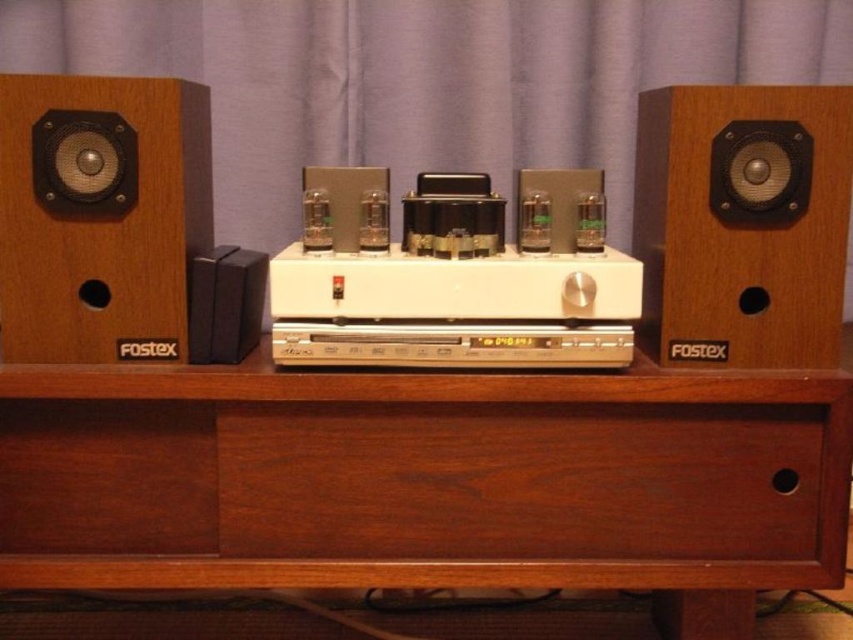
Does purple fabric curtain at upper center appear on the left side of wooden speaker at left?

In fact, purple fabric curtain at upper center is to the right of wooden speaker at left.

Does purple fabric curtain at upper center appear on the right side of wooden speaker at left?

Correct, you'll find purple fabric curtain at upper center to the right of wooden speaker at left.

Who is more forward, (747, 81) or (51, 264)?

Point (51, 264)

What are the coordinates of `purple fabric curtain at upper center` in the screenshot? It's located at (424, 81).

Does brown wood table at center have a larger size compared to black matte speaker at center?

Yes, brown wood table at center is bigger than black matte speaker at center.

Is brown wood table at center taller than black matte speaker at center?

Correct, brown wood table at center is much taller as black matte speaker at center.

Between point (419, 476) and point (230, 264), which one is positioned in front?

Point (230, 264) is more forward.

The width and height of the screenshot is (853, 640). Identify the location of brown wood table at center. (430, 481).

Which is below, wooden speaker at left or black matte speaker at center?

black matte speaker at center is lower down.

Measure the distance between wooden speaker at left and camera.

wooden speaker at left and camera are 34.23 inches apart from each other.

Is point (169, 134) positioned in front of point (228, 246)?

Yes, point (169, 134) is closer to viewer.

Locate an element on the screen. Image resolution: width=853 pixels, height=640 pixels. wooden speaker at left is located at coordinates (100, 216).